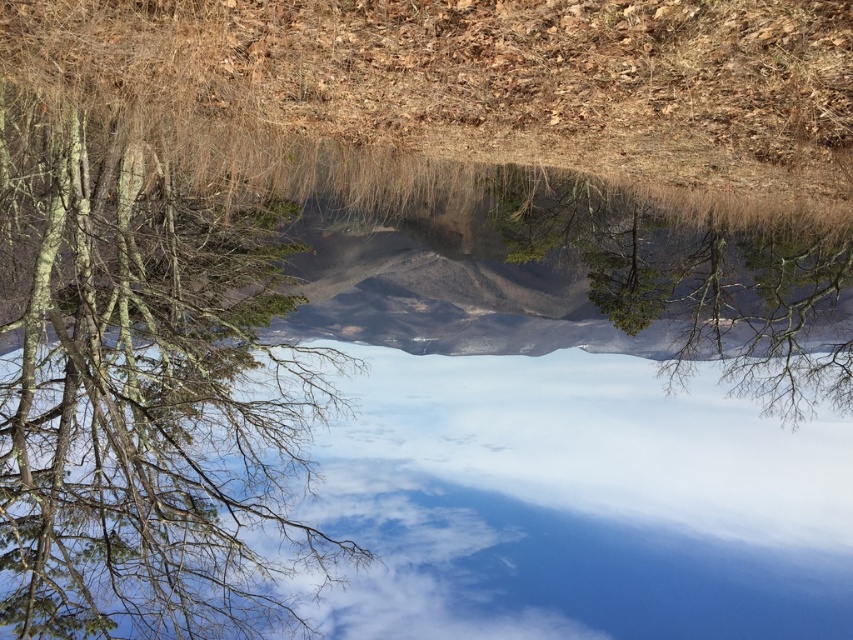
Who is more forward, (242, 316) or (822, 481)?

Point (242, 316)

Which is more to the left, barky brown tree at left or cloudy sky at center?

barky brown tree at left is more to the left.

This screenshot has width=853, height=640. Identify the location of barky brown tree at left. tap(143, 394).

Looking at this image, which of these two, cloudy sky at center or green matte tree at center, stands taller?

cloudy sky at center is taller.

What are the coordinates of `cloudy sky at center` in the screenshot? It's located at (578, 502).

Where is `barky brown tree at left`? The image size is (853, 640). barky brown tree at left is located at coordinates (143, 394).

Does point (195, 512) come in front of point (799, 241)?

Yes, point (195, 512) is closer to viewer.

At what (x,y) coordinates should I click in order to perform the action: click on barky brown tree at left. Please return your answer as a coordinate pair (x, y). Looking at the image, I should click on (143, 394).